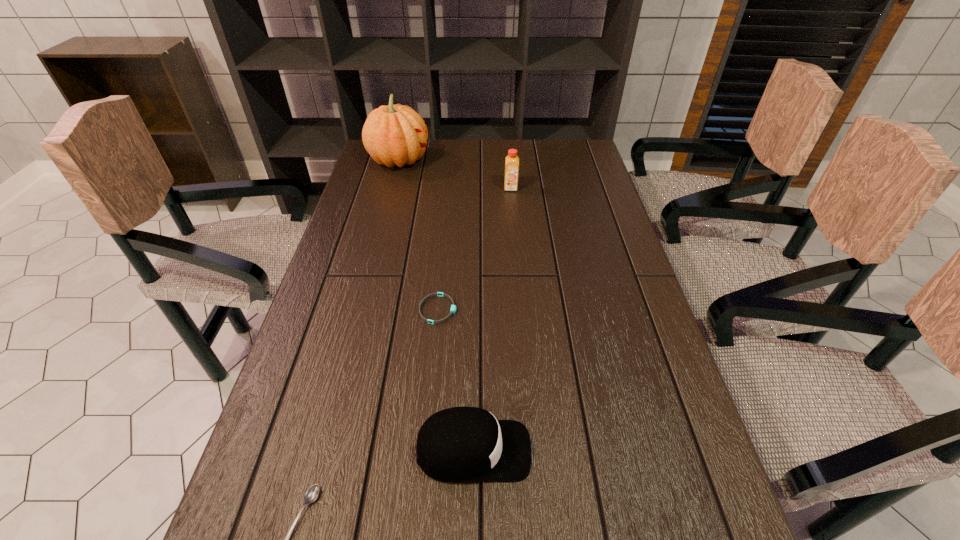
Locate an element on the screen. This screenshot has width=960, height=540. vacant region that satisfies the following two spatial constraints: 1. on the front and back of the fourth nearest object; 2. on the buckle of the fourth tallest object is located at coordinates (522, 309).

This screenshot has height=540, width=960. Identify the location of free point that satisfies the following two spatial constraints: 1. on the front and back of the second farthest object; 2. on the buckle of the wristband. (522, 309).